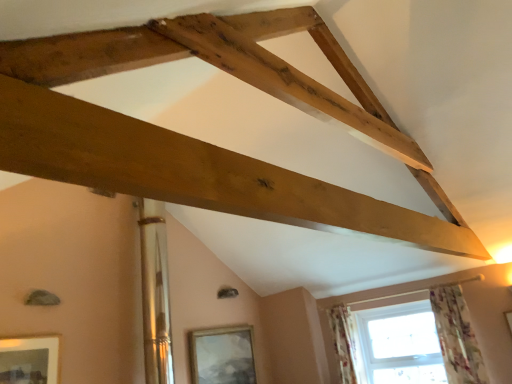
Question: Does matte silver picture frame at lower center, positioned as the 1th picture frame in back-to-front order, have a greater width compared to floral fabric curtain at lower right, the first curtain viewed from the left?

Choices:
 (A) no
 (B) yes

Answer: (A)

Question: Is matte silver picture frame at lower center, which is counted as the 1th picture frame, starting from the right, positioned far away from floral fabric curtain at lower right, arranged as the second curtain when viewed from the front?

Choices:
 (A) yes
 (B) no

Answer: (A)

Question: Considering the relative sizes of matte silver picture frame at lower center, positioned as the 1th picture frame in back-to-front order, and floral fabric curtain at lower right, arranged as the second curtain when viewed from the front, in the image provided, is matte silver picture frame at lower center, positioned as the 1th picture frame in back-to-front order, taller than floral fabric curtain at lower right, arranged as the second curtain when viewed from the front,?

Choices:
 (A) yes
 (B) no

Answer: (B)

Question: Is matte silver picture frame at lower center, acting as the 1th picture frame starting from the bottom, shorter than floral fabric curtain at lower right, arranged as the second curtain when viewed from the front?

Choices:
 (A) yes
 (B) no

Answer: (A)

Question: Is matte silver picture frame at lower center, the second picture frame positioned from the left, beside floral fabric curtain at lower right, marked as the first curtain in a back-to-front arrangement?

Choices:
 (A) no
 (B) yes

Answer: (A)

Question: Choose the correct answer: Is natural wood beam at upper center inside clear glass window at lower right or outside it?

Choices:
 (A) outside
 (B) inside

Answer: (A)

Question: From the image's perspective, relative to clear glass window at lower right, is natural wood beam at upper center above or below?

Choices:
 (A) above
 (B) below

Answer: (A)

Question: Is point (331, 230) closer or farther from the camera than point (337, 317)?

Choices:
 (A) farther
 (B) closer

Answer: (B)

Question: From a real-world perspective, is natural wood beam at upper center above or below clear glass window at lower right?

Choices:
 (A) below
 (B) above

Answer: (B)

Question: Considering the positions of clear glass window at lower right and floral fabric curtain at lower right, marked as the first curtain in a back-to-front arrangement, in the image, is clear glass window at lower right wider or thinner than floral fabric curtain at lower right, marked as the first curtain in a back-to-front arrangement,?

Choices:
 (A) wide
 (B) thin

Answer: (B)

Question: Do you think clear glass window at lower right is within floral fabric curtain at lower right, arranged as the second curtain when viewed from the front, or outside of it?

Choices:
 (A) inside
 (B) outside

Answer: (B)

Question: Based on their sizes in the image, would you say clear glass window at lower right is bigger or smaller than floral fabric curtain at lower right, marked as the first curtain in a back-to-front arrangement?

Choices:
 (A) small
 (B) big

Answer: (B)

Question: From a real-world perspective, is clear glass window at lower right physically located above or below floral fabric curtain at lower right, the first curtain viewed from the left?

Choices:
 (A) above
 (B) below

Answer: (B)

Question: Is matte gold picture frame at lower left, the first picture frame in the front-to-back sequence, inside or outside of clear glass window at lower right?

Choices:
 (A) outside
 (B) inside

Answer: (A)

Question: Is matte gold picture frame at lower left, the first picture frame in the front-to-back sequence, to the left or to the right of clear glass window at lower right in the image?

Choices:
 (A) left
 (B) right

Answer: (A)